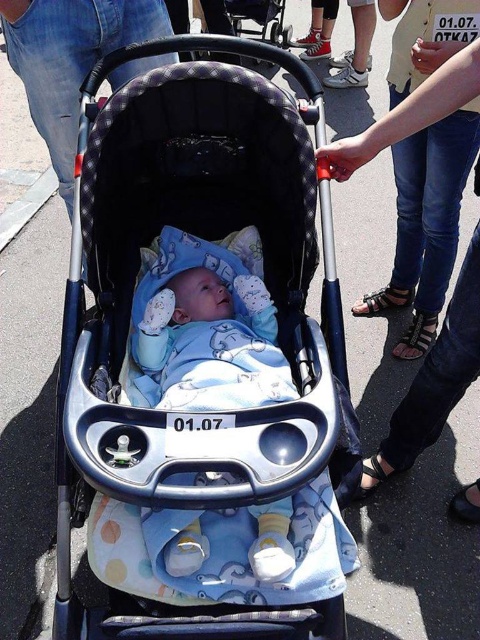
Does point (203, 502) come in front of point (439, 355)?

That is True.

Describe the element at coordinates (130, 314) in the screenshot. The width and height of the screenshot is (480, 640). I see `matte blue fabric baby carriage at center` at that location.

The width and height of the screenshot is (480, 640). What are the coordinates of `matte blue fabric baby carriage at center` in the screenshot? It's located at (130, 314).

Which is behind, point (215, 284) or point (331, 147)?

The point (215, 284) is more distant.

Is point (226, 388) farther from viewer compared to point (444, 356)?

No, it is not.

Describe the element at coordinates (213, 344) in the screenshot. The image size is (480, 640). I see `blue soft fabric baby at center` at that location.

The height and width of the screenshot is (640, 480). Identify the location of blue soft fabric baby at center. (213, 344).

Can you confirm if matte blue fabric baby carriage at center is positioned to the left of blue soft fabric baby at center?

Indeed, matte blue fabric baby carriage at center is positioned on the left side of blue soft fabric baby at center.

Can you confirm if matte blue fabric baby carriage at center is wider than blue soft fabric baby at center?

Indeed, matte blue fabric baby carriage at center has a greater width compared to blue soft fabric baby at center.

Does point (245, 132) come in front of point (259, 568)?

No, it is behind (259, 568).

Find the location of a particular element. The width and height of the screenshot is (480, 640). matte blue fabric baby carriage at center is located at coordinates (130, 314).